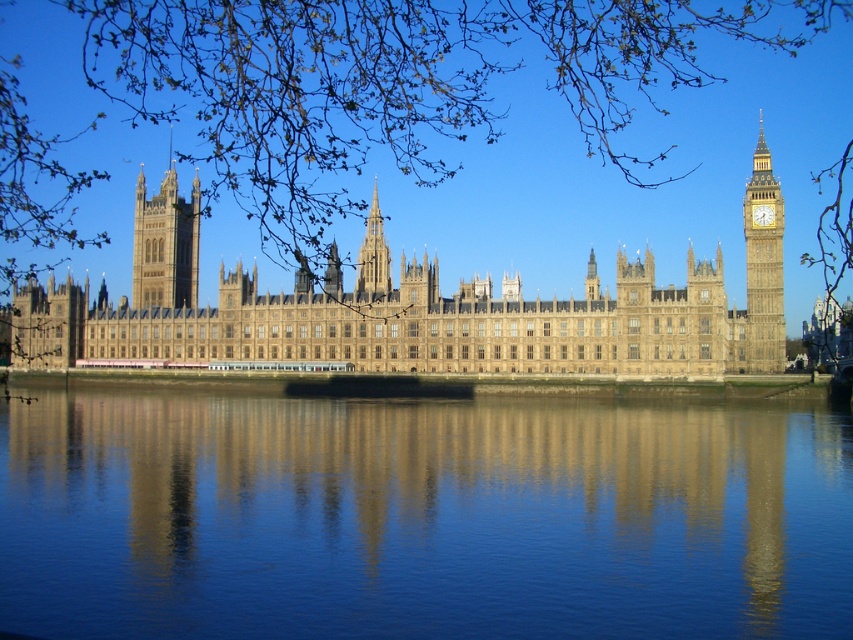
You are a photographer planning to capture the Palace of Westminster from the Thames. You want to ensure your shot includes both the smooth blue water at center and the golden stone clock tower at right. Given their relative sizes, which object will occupy more horizontal space in your photo?

The smooth blue water at center will occupy more horizontal space in the photo because its width surpasses that of the golden stone clock tower at right.

From the picture: You are a tourist standing on the Thames riverbank and want to take a photo of both the golden stone castle at center and the golden stone clock tower at right. Can you fit both in your camera frame if the maximum width your camera can capture is 10 meters?

The golden stone castle at center might be wider than golden stone clock tower at right, so it is uncertain if both can fit within the 10 meter frame without knowing their exact widths.